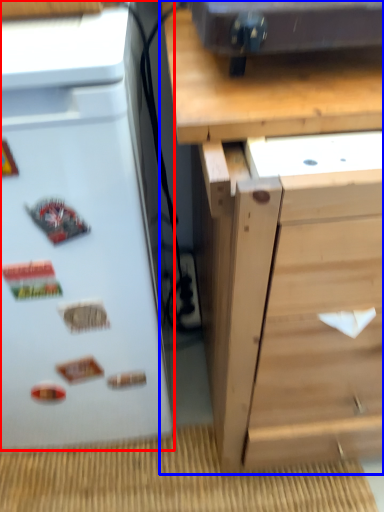
Question: Which object is further to the camera taking this photo, refrigerator (highlighted by a red box) or chest of drawers (highlighted by a blue box)?

Choices:
 (A) refrigerator
 (B) chest of drawers

Answer: (A)